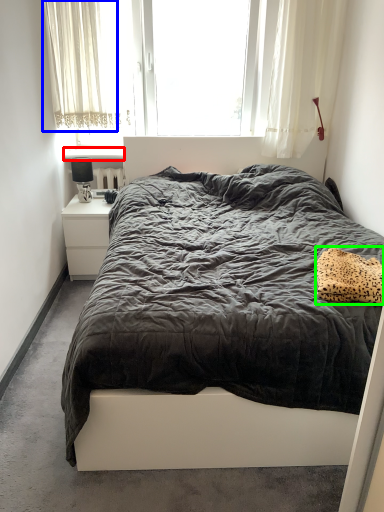
Question: Estimate the real-world distances between objects in this image. Which object is farther from window sill (highlighted by a red box), curtain (highlighted by a blue box) or pillow (highlighted by a green box)?

Choices:
 (A) curtain
 (B) pillow

Answer: (B)